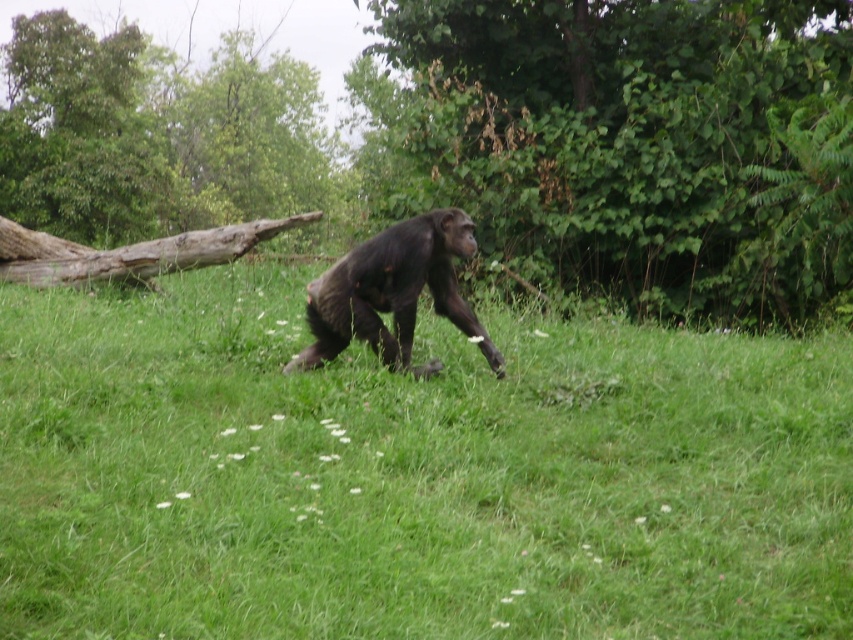
Between green grassy at center and shiny black monkey at center, which one has more height?

With more height is shiny black monkey at center.

Does green grassy at center have a larger size compared to shiny black monkey at center?

Actually, green grassy at center might be smaller than shiny black monkey at center.

Is point (264, 550) more distant than point (347, 332)?

That is False.

Identify the location of green grassy at center. (410, 476).

Between point (57, 198) and point (328, 300), which one is positioned behind?

Positioned behind is point (57, 198).

Which of these two, brown wood log at left or shiny black monkey at center, stands taller?

With more height is brown wood log at left.

Who is more distant from viewer, (16, 61) or (412, 285)?

The point (16, 61) is more distant.

At what (x,y) coordinates should I click in order to perform the action: click on brown wood log at left. Please return your answer as a coordinate pair (x, y). The image size is (853, 640). Looking at the image, I should click on (157, 134).

Between green grassy at center and green leafy tree at center, which one is positioned lower?

Positioned lower is green grassy at center.

Is green grassy at center wider than green leafy tree at center?

Incorrect, green grassy at center's width does not surpass green leafy tree at center's.

Locate an element on the screen. The width and height of the screenshot is (853, 640). green grassy at center is located at coordinates (410, 476).